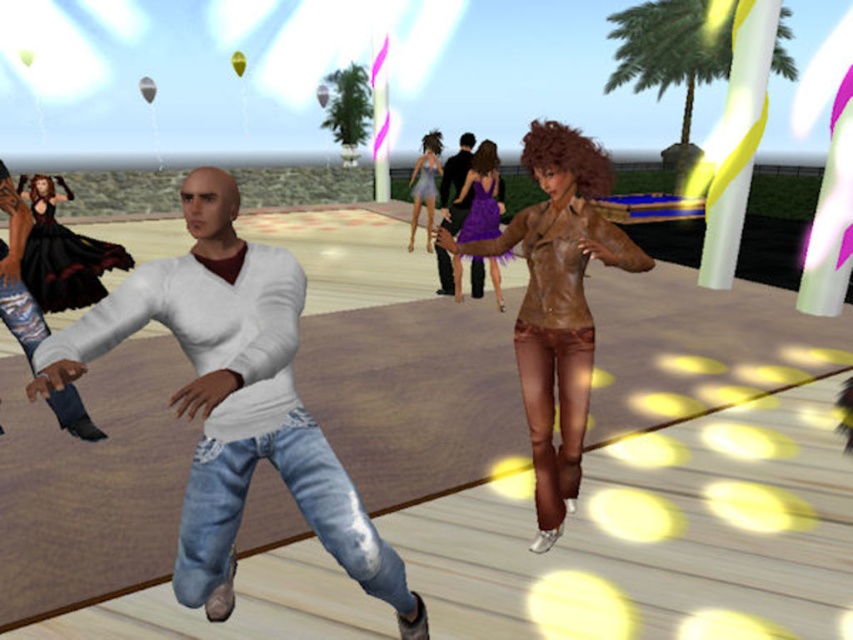
Can you confirm if shiny purple dress at center is positioned above matte white sweater at center?

No, shiny purple dress at center is not above matte white sweater at center.

Is shiny purple dress at center to the left of matte white sweater at center from the viewer's perspective?

In fact, shiny purple dress at center is to the right of matte white sweater at center.

Between point (496, 301) and point (461, 173), which one is positioned in front?

Positioned in front is point (461, 173).

Identify the location of shiny purple dress at center. The height and width of the screenshot is (640, 853). (480, 195).

Which is more to the left, black satin dress at left or shiny purple dress at center?

black satin dress at left

Can you confirm if black satin dress at left is taller than shiny purple dress at center?

No.

Is point (53, 304) farther from viewer compared to point (479, 196)?

That is False.

Where is `black satin dress at left`? black satin dress at left is located at coordinates (62, 253).

The width and height of the screenshot is (853, 640). What do you see at coordinates (234, 401) in the screenshot? I see `white matte shirt at center` at bounding box center [234, 401].

Image resolution: width=853 pixels, height=640 pixels. I want to click on white matte shirt at center, so click(x=234, y=401).